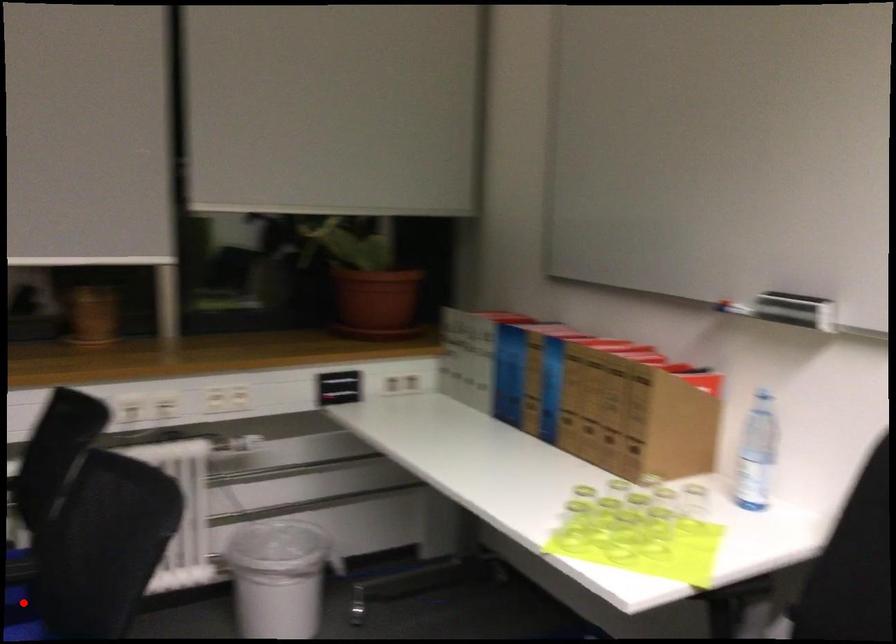
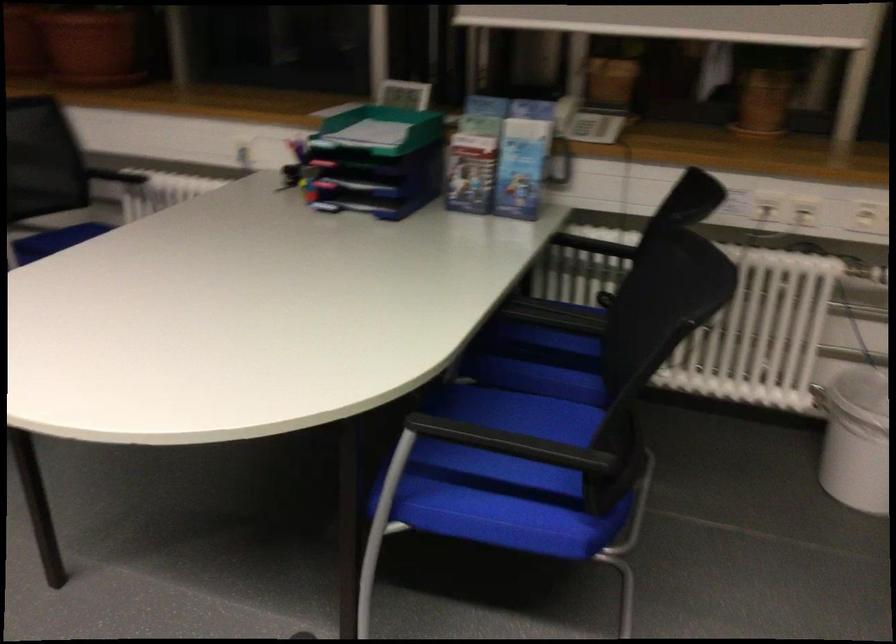
Question: I am providing you with two images of the same scene from different viewpoints. A red point is marked on the first image. At the location where the point appears in image 1, is it still visible in image 2?

Choices:
 (A) Yes
 (B) No

Answer: (B)